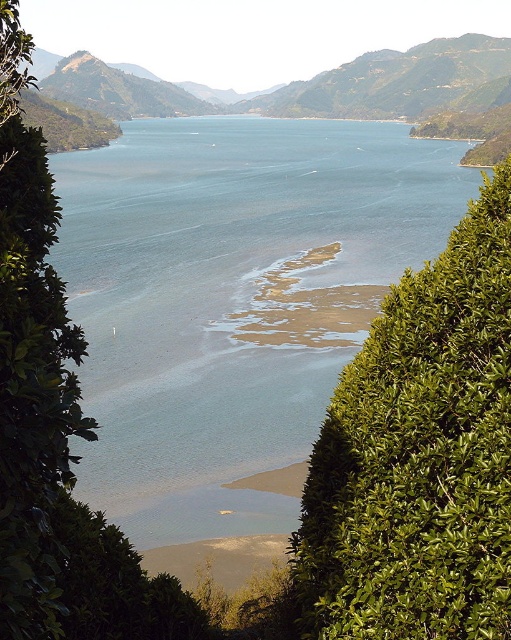
You are standing at the edge of the serene landscape with a large body of water. You want to reach a point marked as point (425,193). Given that the distance between you and this point is 108.27 meters, can you estimate how far you need to walk to get there?

The distance between you and point (425,193) is 108.27 meters, so you need to walk approximately 108.27 meters to reach it.

You are standing at the edge of the lake and want to take a photo of the green leafy bush at center and the clear blue water at center. Which object will appear closer to the camera in the photo?

The clear blue water at center will appear closer to the camera because the green leafy bush at center is behind it.

You are a drone operator planning to fly a drone between the clear blue water at center and the green leafy bush at center. The drone has a maximum flight distance of 90 meters. Can the drone safely make the trip without exceeding its range?

The clear blue water at center and green leafy bush at center are 92.35 meters apart, which exceeds the drone operator drone maximum flight distance of 90 meters. The drone cannot safely make the trip without exceeding its range.